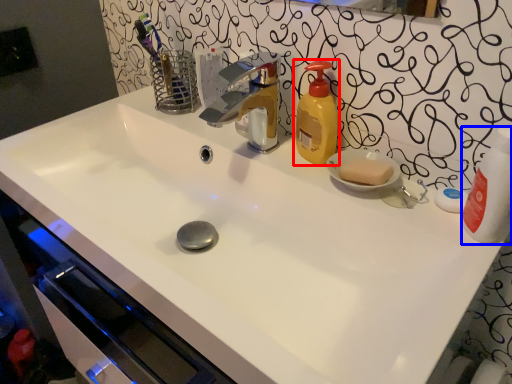
Question: Which object appears closest to the camera in this image, soap dispenser (highlighted by a red box) or cleaning product (highlighted by a blue box)?

Choices:
 (A) soap dispenser
 (B) cleaning product

Answer: (B)